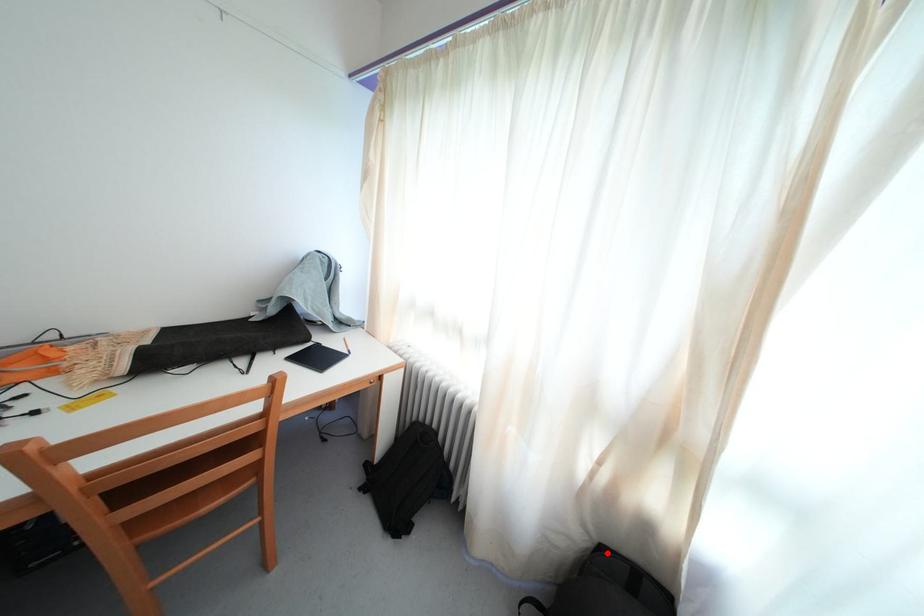
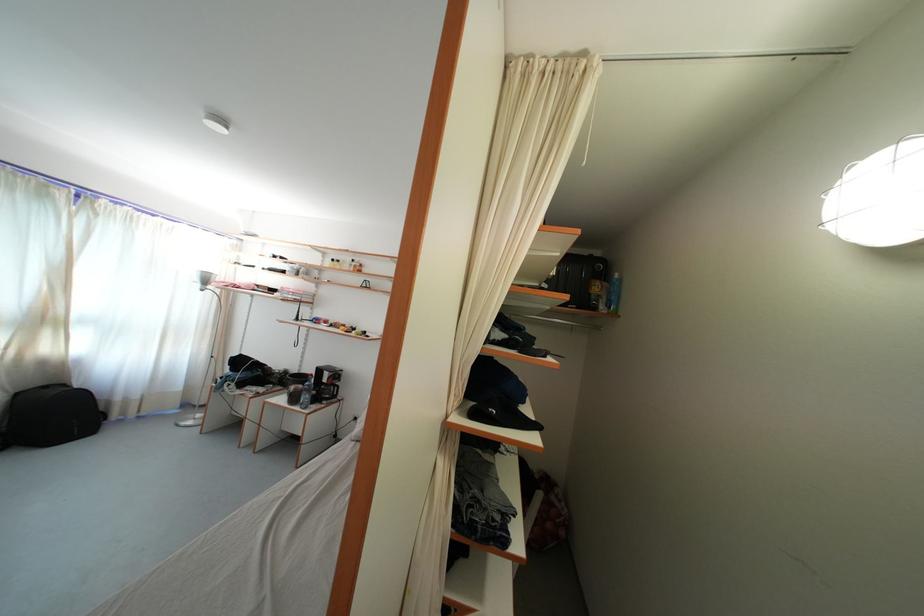
Question: I am providing you with two images of the same scene from different viewpoints. Image1 has a red point marked. In image2, the corresponding 3D location appears at what relative position? Reply with the corresponding letter.

Choices:
 (A) Closer
 (B) Farther

Answer: (B)